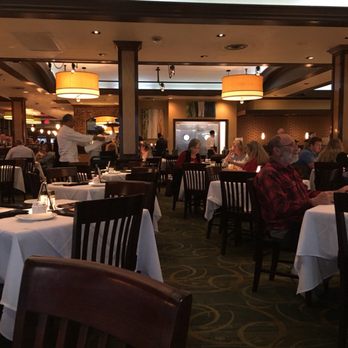
What are the coordinates of `wall lights` in the screenshot? It's located at (262, 135), (305, 135).